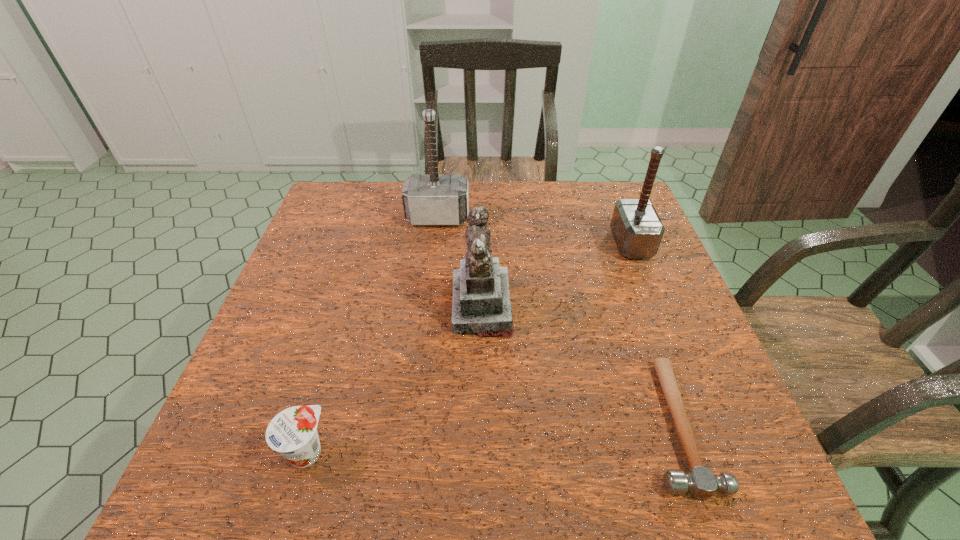
Where is `vacant space situated on the back of the fourth tallest object`? Image resolution: width=960 pixels, height=540 pixels. vacant space situated on the back of the fourth tallest object is located at coordinates (348, 307).

This screenshot has height=540, width=960. Find the location of `free space located on the left of the nearest hammer`. free space located on the left of the nearest hammer is located at coordinates (586, 424).

At what (x,y) coordinates should I click in order to perform the action: click on object located at the far edge. Please return your answer as a coordinate pair (x, y). Looking at the image, I should click on (437, 199).

Image resolution: width=960 pixels, height=540 pixels. Identify the location of yogurt that is at the near edge. (293, 432).

In order to click on hammer that is positioned at the near edge in this screenshot , I will do `click(700, 481)`.

Where is `object present at the left edge`? The height and width of the screenshot is (540, 960). object present at the left edge is located at coordinates (293, 432).

I want to click on object that is at the near left corner, so click(x=293, y=432).

Identify the location of object located in the near right corner section of the desktop. The height and width of the screenshot is (540, 960). (700, 481).

In order to click on free spot at the left edge of the desktop in this screenshot , I will do `click(338, 255)`.

You are a GUI agent. You are given a task and a screenshot of the screen. Output one action in this format:
    pyautogui.click(x=<x>, y=<y>)
    Task: Click on the vacant space at the right edge of the desktop
    The width and height of the screenshot is (960, 540).
    Given the screenshot: What is the action you would take?
    pyautogui.click(x=652, y=282)